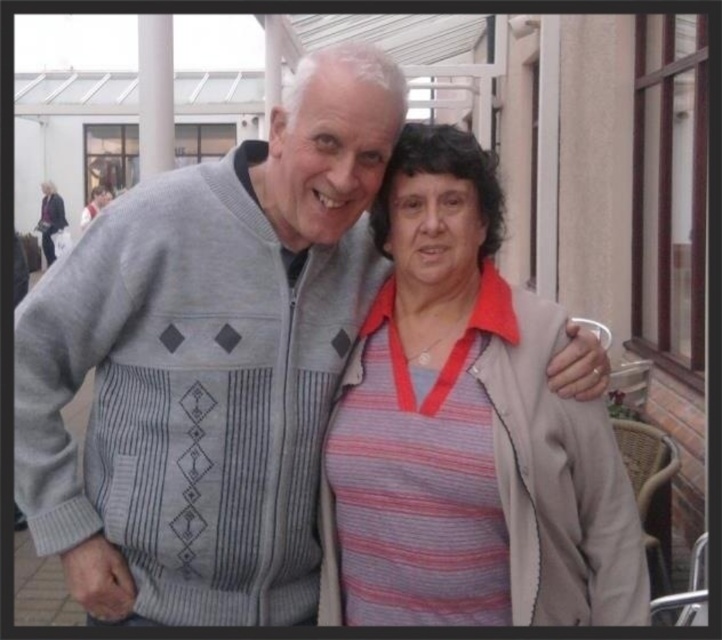
Question: Among these points, which one is farthest from the camera?

Choices:
 (A) (87, 216)
 (B) (56, 214)
 (C) (443, 561)

Answer: (B)

Question: Which of the following is the farthest from the observer?

Choices:
 (A) striped fabric shirt at center
 (B) striped fabric sweater at center
 (C) striped fabric sweater at upper left

Answer: (C)

Question: Considering the relative positions of striped fabric shirt at center and striped fabric sweater at upper left in the image provided, where is striped fabric shirt at center located with respect to striped fabric sweater at upper left?

Choices:
 (A) left
 (B) right

Answer: (B)

Question: Does striped fabric shirt at center appear under striped fabric sweater at upper left?

Choices:
 (A) yes
 (B) no

Answer: (A)

Question: Which object appears farthest from the camera in this image?

Choices:
 (A) striped fabric sweater at upper left
 (B) striped fabric sweater at center
 (C) striped fabric shirt at center

Answer: (A)

Question: From the image, what is the correct spatial relationship of striped fabric shirt at center in relation to striped fabric sweater at center?

Choices:
 (A) below
 (B) above

Answer: (A)